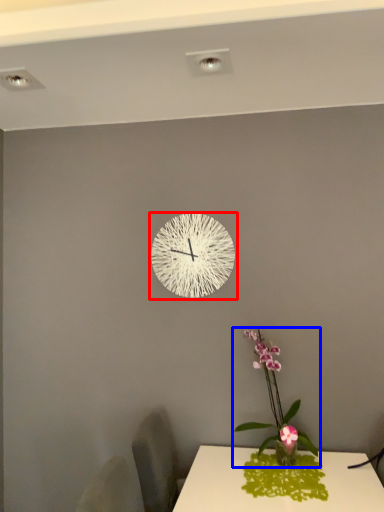
Question: Which point is closer to the camera, wall clock (highlighted by a red box) or houseplant (highlighted by a blue box)?

Choices:
 (A) wall clock
 (B) houseplant

Answer: (B)